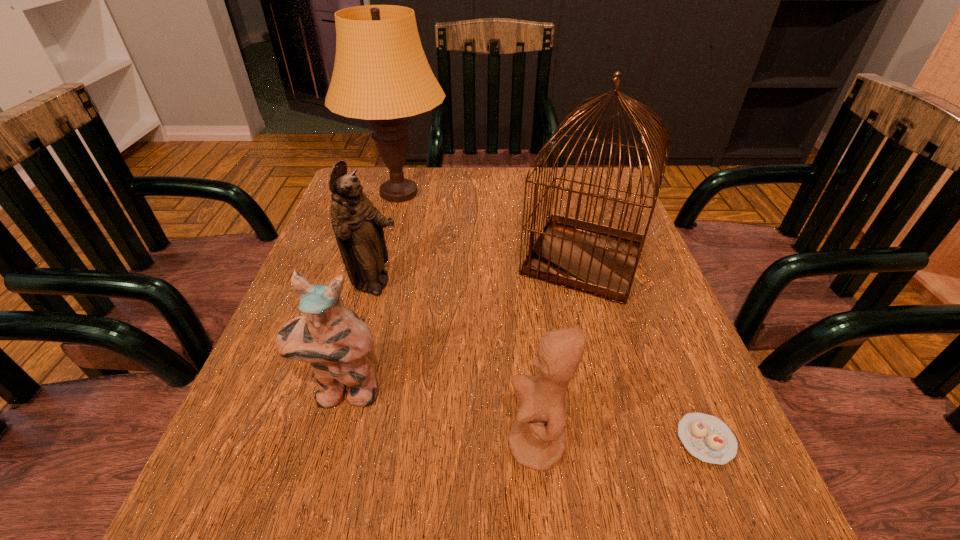
The width and height of the screenshot is (960, 540). I want to click on vacant region located on the front-facing side of the rightmost figurine, so click(x=382, y=445).

In order to click on vacant region located on the left of the cupcake in this screenshot , I will do `click(553, 440)`.

Locate an element on the screen. object situated at the far edge is located at coordinates (381, 74).

Locate an element on the screen. This screenshot has height=540, width=960. lampshade present at the left edge is located at coordinates (381, 74).

The height and width of the screenshot is (540, 960). Identify the location of birdcage situated at the right edge. (599, 260).

Identify the location of cupcake positioned at the right edge. (706, 437).

I want to click on object present at the far left corner, so click(x=381, y=74).

Where is `vacant point at the far edge`? vacant point at the far edge is located at coordinates (514, 200).

The image size is (960, 540). Find the location of `vacant space at the near edge of the desktop`. vacant space at the near edge of the desktop is located at coordinates (329, 522).

In the image, there is a desktop. Where is `free space at the left edge`? The width and height of the screenshot is (960, 540). free space at the left edge is located at coordinates (282, 481).